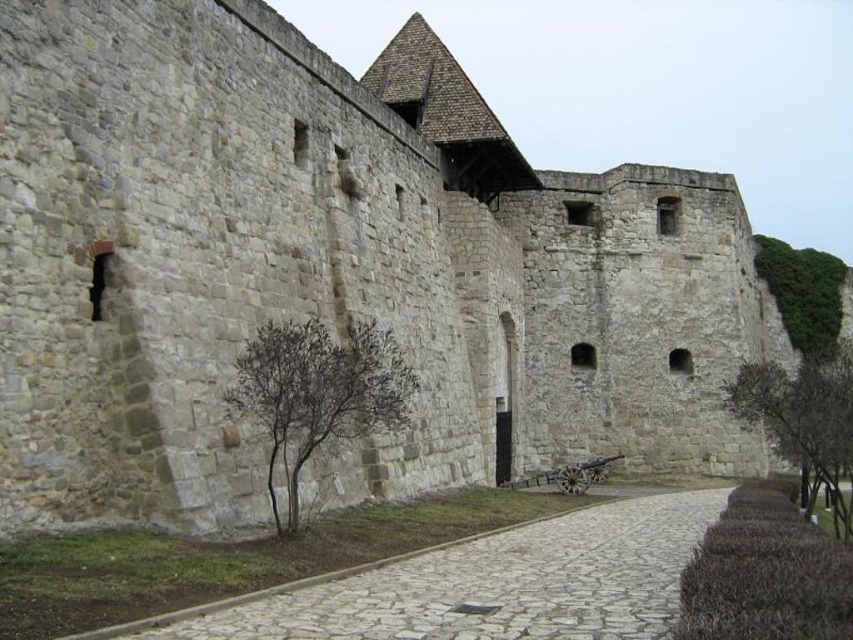
You are an architect examining the medieval fortress. You notice two trees growing near the fortress walls. The first is a brown textured tree at center, and the second is a brown leafy tree at right. Which tree has a smaller width?

The brown textured tree at center has a smaller width than the brown leafy tree at right.

You are a knight standing at the entrance of the fortress. You see a pebble stone path at center and a brown leafy tree at right. Which one takes up more space in the scene?

The brown leafy tree at right takes up more space than the pebble stone path at center.